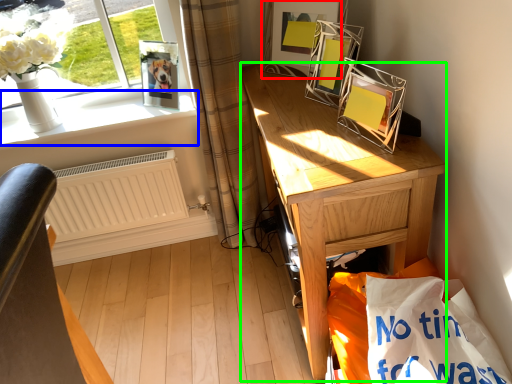
Question: Estimate the real-world distances between objects in this image. Which object is farther from picture frame (highlighted by a red box), window sill (highlighted by a blue box) or desk (highlighted by a green box)?

Choices:
 (A) window sill
 (B) desk

Answer: (A)